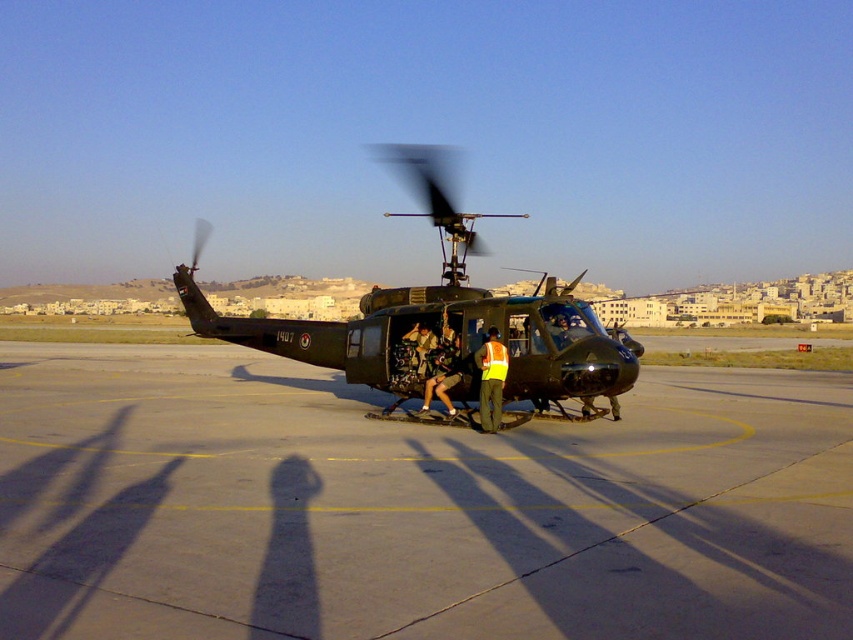
You are a maintenance crew member approaching the matte black helicopter at center to inspect its tail section. There is a reflective orange vest at center nearby. Which object is closer to you as you approach?

The matte black helicopter at center is closer to you than the reflective orange vest at center as you approach.

You are a safety inspector checking the visibility of workers near the UH60 Black Hawk. You see the reflective orange vest at center and the camouflage fabric uniform at center. Which clothing item is narrower in width?

The reflective orange vest at center has a width less than the camouflage fabric uniform at center, so the reflective orange vest at center is narrower in width.